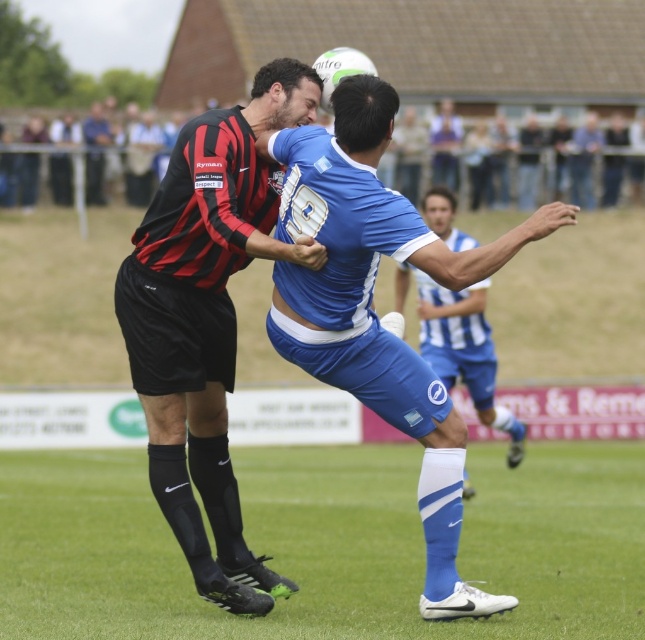
You are a soccer coach analyzing the field layout. You notice the green grass at center and the blue jersey at center. Which object takes up more horizontal space in the image?

The green grass at center has a greater width than the blue jersey at center, so it takes up more horizontal space.

You are a photographer standing at the edge of the soccer field. You want to take a closeup photo of the blue matte jersey at center. The camera you are using has a minimum focusing distance of 5 meters. Can you take the photo without moving closer?

The blue matte jersey at center is 8.18 meters away from the camera, which is beyond the minimum focusing distance of 5 meters. Therefore, you can take the photo without moving closer.